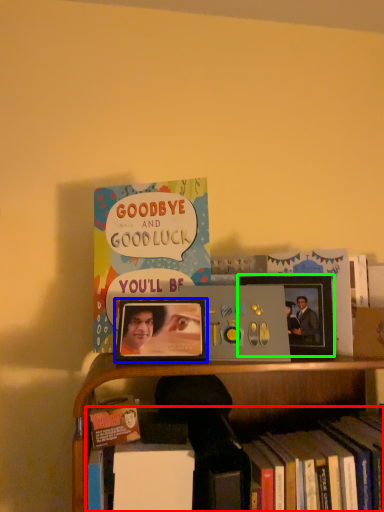
Question: Which object is the farthest from book (highlighted by a red box)? Choose among these: picture frame (highlighted by a blue box) or picture frame (highlighted by a green box).

Choices:
 (A) picture frame
 (B) picture frame

Answer: (B)